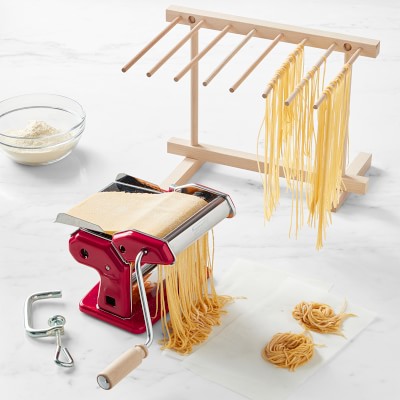
You are a GUI agent. You are given a task and a screenshot of the screen. Output one action in this format:
    pyautogui.click(x=<x>, y=<y>)
    Task: Click on the counter
    This screenshot has width=400, height=400.
    Given the screenshot: What is the action you would take?
    pyautogui.click(x=44, y=190)